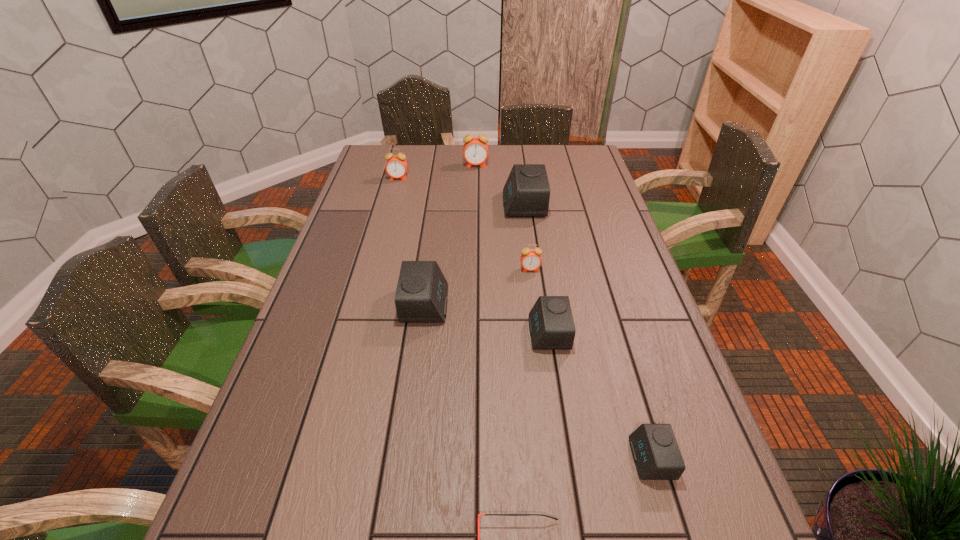
The width and height of the screenshot is (960, 540). What are the coordinates of `the farthest object` in the screenshot? It's located at (475, 151).

This screenshot has height=540, width=960. I want to click on the tallest object, so click(475, 151).

Locate an element on the screen. Image resolution: width=960 pixels, height=540 pixels. the seventh nearest object is located at coordinates (396, 166).

At what (x,y) coordinates should I click in order to perform the action: click on the second biggest pink alarm clock. Please return your answer as a coordinate pair (x, y). The image size is (960, 540). Looking at the image, I should click on (396, 166).

Find the location of a particular element. This screenshot has height=540, width=960. the biggest black alarm clock is located at coordinates (526, 193).

The height and width of the screenshot is (540, 960). Find the location of `the third farthest object`. the third farthest object is located at coordinates (526, 193).

Locate an element on the screen. This screenshot has height=540, width=960. the sixth alarm clock from right to left is located at coordinates (421, 295).

The height and width of the screenshot is (540, 960). In order to click on the second biggest black alarm clock in this screenshot , I will do `click(421, 295)`.

This screenshot has height=540, width=960. I want to click on the fourth farthest object, so click(531, 260).

Locate an element on the screen. This screenshot has width=960, height=540. the rightmost pink alarm clock is located at coordinates (531, 260).